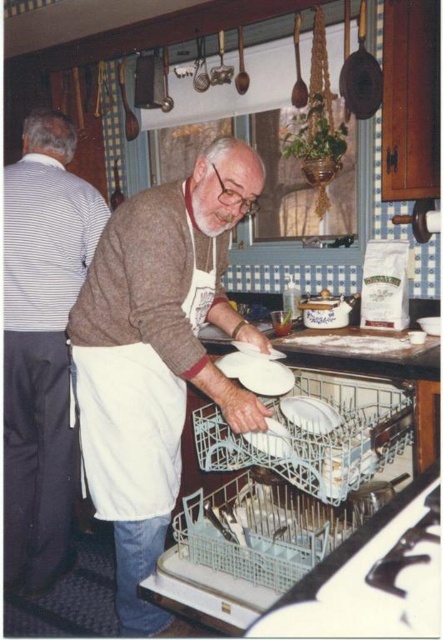
You are standing in the kitchen and see two points marked in the image. Which point is closer to you, point (49, 172) or point (318, 417)?

Point (49, 172) is closer to you because it is further to the viewer than point (318, 417).

You are a chef preparing to hang a new kitchen tool on the wall. You notice the white apron at left and the white glossy platter at center. Which object is taller and should you consider its height when choosing where to place the tool?

The white apron at left is taller than the white glossy platter at center, so you should consider its height to ensure the new tool doesn